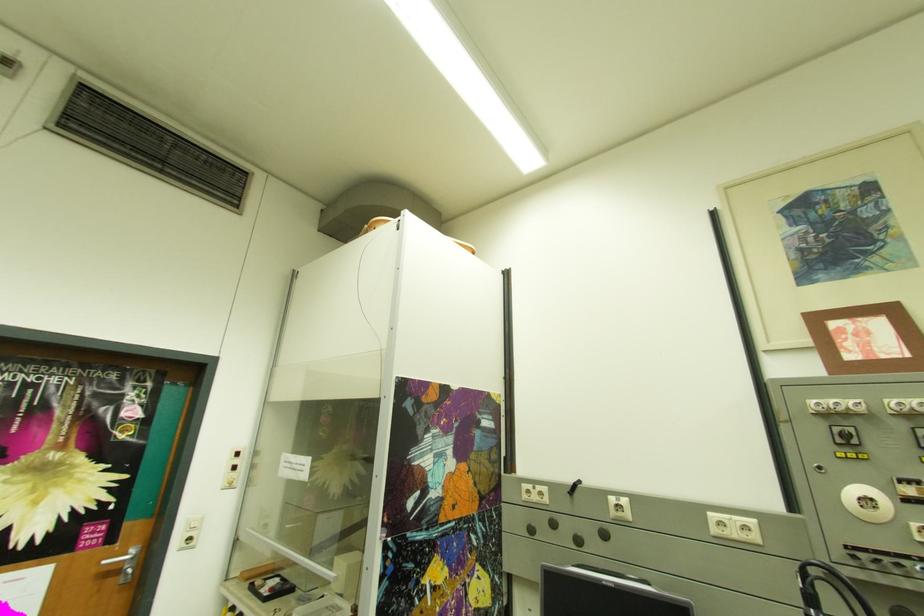
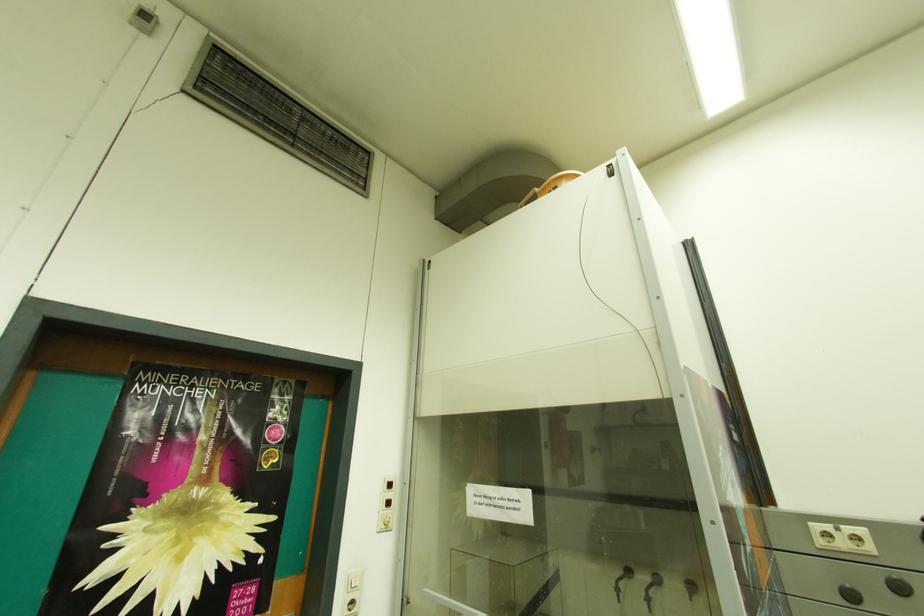
The point at (536, 487) is marked in the first image. Where is the corresponding point in the second image?

(827, 527)